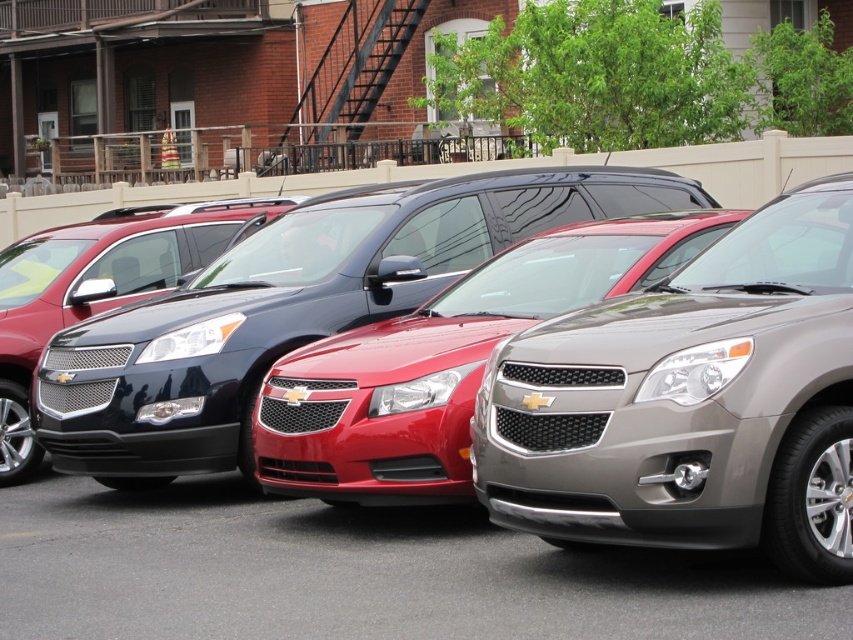
You are standing in front of the row of Chevrolet vehicles. You see a glossy black minivan at center and a satin black suv at center. Which one is positioned to the right of the other?

The glossy black minivan at center is positioned to the right of the satin black suv at center.

You are a delivery person trying to reach the front door of the house, which is located behind the vehicles. The metallic red car at center and the glossy black minivan at center are blocking the path. Which vehicle should you move first to access the door?

The metallic red car at center is in front of the glossy black minivan at center, so you should move the metallic red car at center first to access the door.